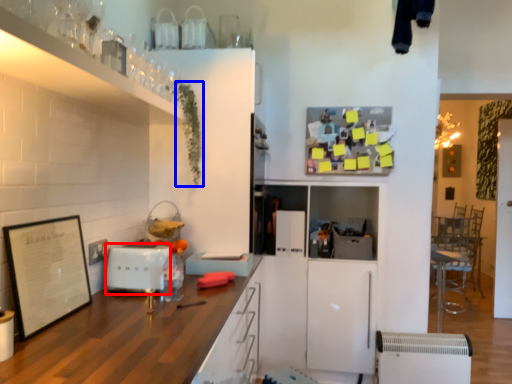
Question: Which point is closer to the camera, appliance (highlighted by a red box) or plant (highlighted by a blue box)?

Choices:
 (A) appliance
 (B) plant

Answer: (A)